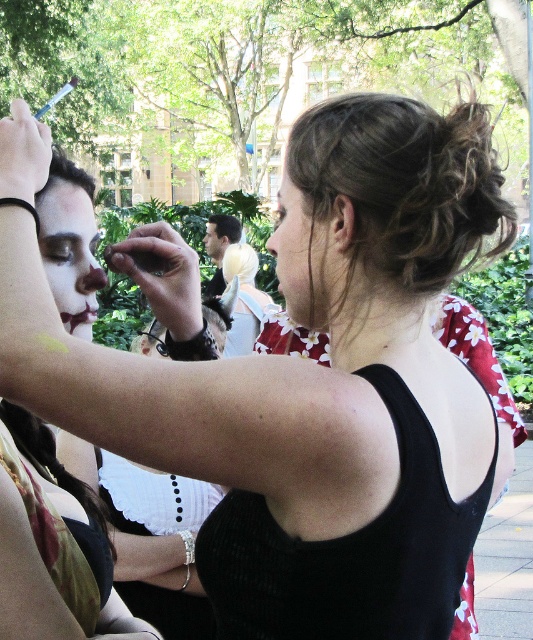
You are a makeup artist preparing for a theatrical performance. You have two items in your kit, the matte black face paint at center and the matte white eyebrow at upper left. Which item is taller?

The matte black face paint at center is taller than the matte white eyebrow at upper left.